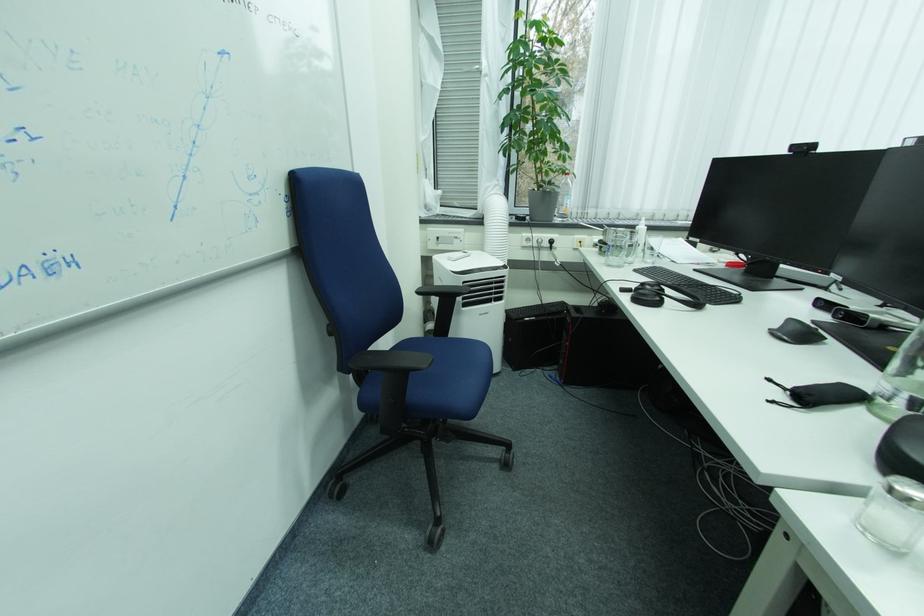
Find where to sit the blue chair sitting surface. Please return your answer as a coordinate pair (x, y).

(454, 369)